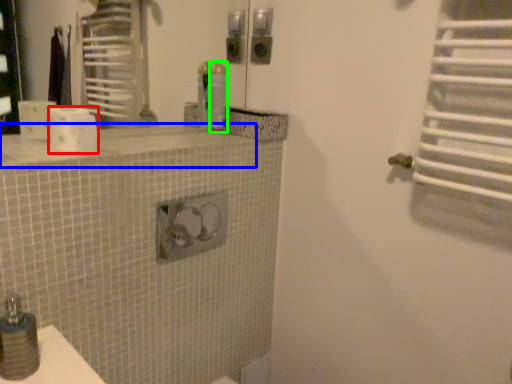
Question: Based on their relative distances, which object is farther from toilet paper (highlighted by a red box)? Choose from counter top (highlighted by a blue box) and toiletry (highlighted by a green box).

Choices:
 (A) counter top
 (B) toiletry

Answer: (B)